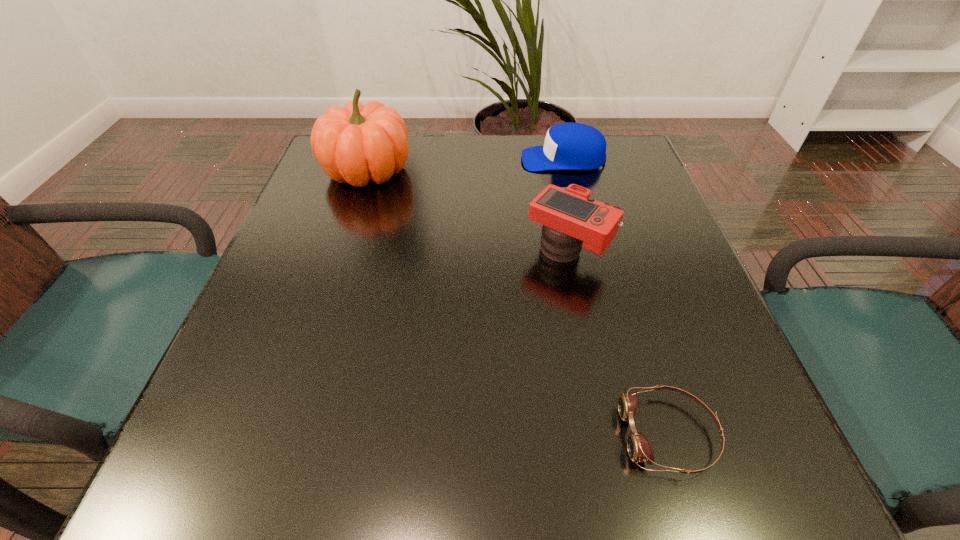
Locate an element on the screen. This screenshot has width=960, height=540. baseball cap that is positioned at the right edge is located at coordinates (568, 146).

At what (x,y) coordinates should I click in order to perform the action: click on goggles present at the right edge. Please return your answer as a coordinate pair (x, y). This screenshot has width=960, height=540. Looking at the image, I should click on (639, 448).

Locate an element on the screen. The width and height of the screenshot is (960, 540). object at the far left corner is located at coordinates (359, 143).

Where is `object located in the far right corner section of the desktop`? object located in the far right corner section of the desktop is located at coordinates (568, 146).

Locate an element on the screen. object present at the near right corner is located at coordinates [639, 448].

The width and height of the screenshot is (960, 540). What are the coordinates of `free space at the far edge` in the screenshot? It's located at (516, 154).

The height and width of the screenshot is (540, 960). In the image, there is a desktop. Find the location of `vacant space at the near edge`. vacant space at the near edge is located at coordinates (x=423, y=466).

This screenshot has width=960, height=540. I want to click on vacant position at the left edge of the desktop, so click(295, 400).

Identify the location of blank space at the right edge. (665, 300).

In the image, there is a desktop. In order to click on free region at the far left corner in this screenshot , I will do `click(324, 182)`.